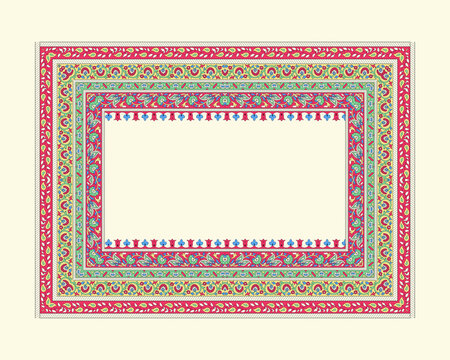
You are a GUI agent. You are given a task and a screenshot of the screen. Output one action in this format:
    pyautogui.click(x=<x>, y=<y>)
    Task: Click on the third border of rug
    The image size is (450, 360).
    Given the screenshot: What is the action you would take?
    pyautogui.click(x=211, y=274)